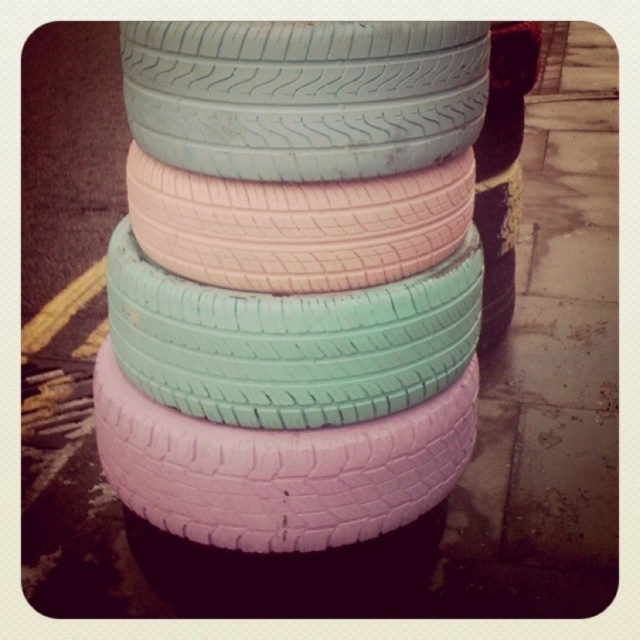
Does light blue rubber tire at center appear on the right side of pink matte tire at center?

Indeed, light blue rubber tire at center is positioned on the right side of pink matte tire at center.

Describe the element at coordinates (304, 93) in the screenshot. I see `light blue rubber tire at center` at that location.

Which is behind, point (282, 68) or point (387, 532)?

The point (387, 532) is behind.

Where is `light blue rubber tire at center`? light blue rubber tire at center is located at coordinates (304, 93).

Which is more to the left, pastel matte tires at center or light blue rubber tire at center?

pastel matte tires at center is more to the left.

Does point (308, 180) lie behind point (218, 68)?

Yes, it is behind point (218, 68).

Image resolution: width=640 pixels, height=640 pixels. Identify the location of pastel matte tires at center. (292, 276).

Between pastel matte tires at center and pink matte tire at center, which one appears on the left side from the viewer's perspective?

pink matte tire at center is more to the left.

Does pastel matte tires at center have a greater width compared to pink matte tire at center?

Correct, the width of pastel matte tires at center exceeds that of pink matte tire at center.

Find the location of a particular element. The height and width of the screenshot is (640, 640). pastel matte tires at center is located at coordinates (292, 276).

I want to click on pastel matte tires at center, so click(292, 276).